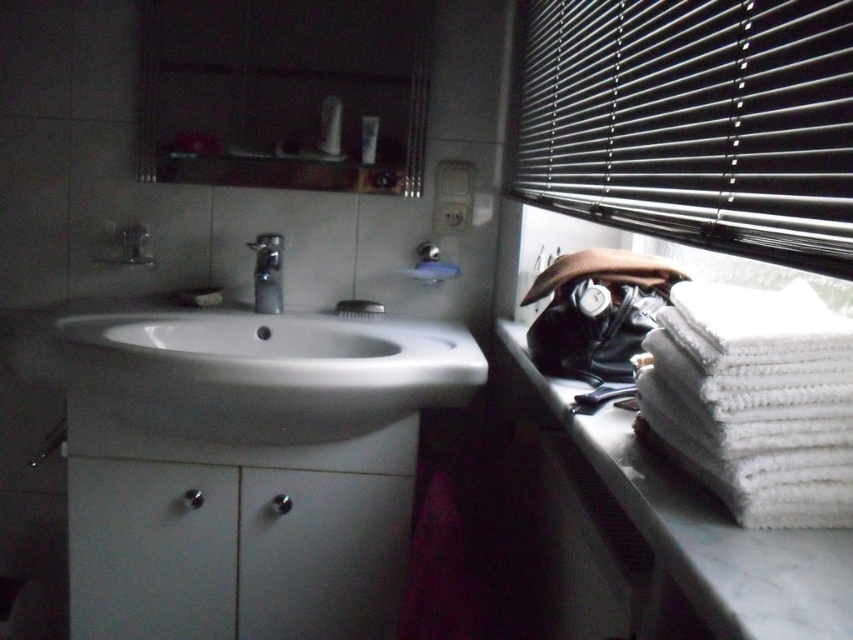
You are standing in front of the bathroom sink. You need to place a small item on the countertop. Which object, the white marble towel at right or the satin nickel faucet at center, is closer to you so you can place the item there?

The white marble towel at right is closer to the viewer than the satin nickel faucet at center, so you can place the item there.

Looking at this image, you are standing in front of the bathroom sink and need to place a new toothbrush holder. The holder requires a space taller than the satin nickel faucet at center. Can the white marble towel at right provide enough vertical space for this?

The white marble towel at right is much taller than the satin nickel faucet at center, so it can provide sufficient vertical space for the toothbrush holder.

You are organizing the bathroom and want to place a new decorative item on the countertop. You have a small vase that needs to be placed above the white marble towel at right but not directly under the white plastic bottle at upper center. Where should you position it?

The white marble towel at right is positioned under the white plastic bottle at upper center. To place the vase above the white marble towel at right without being directly under the bottle, position it to the side of the towel, ensuring it is not aligned vertically with the bottle.